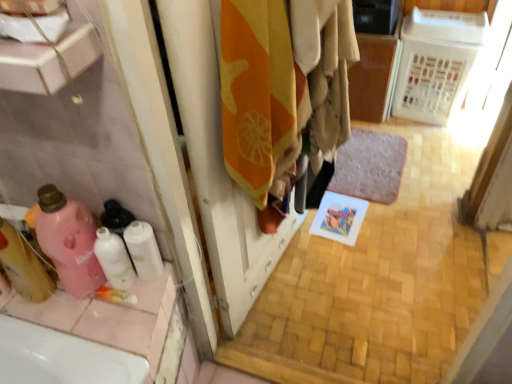
This screenshot has height=384, width=512. I want to click on vacant space in between gray plush bath mat at center and white plastic laundry basket at upper right, so click(x=416, y=151).